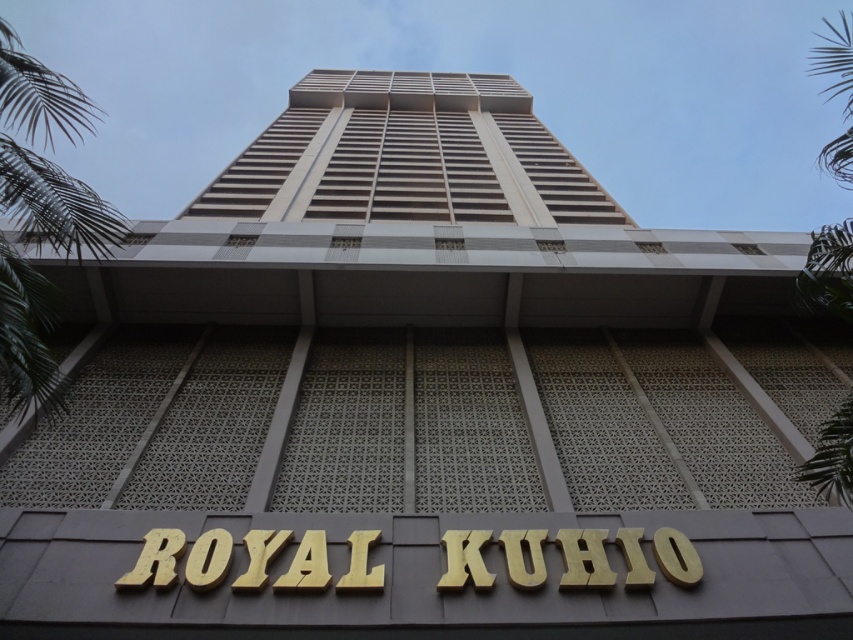
Question: Which point is closer to the camera?

Choices:
 (A) green leafy palm tree at left
 (B) beige concrete building at center
 (C) green leafy palm tree at right

Answer: (A)

Question: Where is beige concrete building at center located in relation to green leafy palm tree at left in the image?

Choices:
 (A) above
 (B) below

Answer: (A)

Question: Can you confirm if beige concrete building at center is positioned to the left of green leafy palm tree at left?

Choices:
 (A) no
 (B) yes

Answer: (A)

Question: Is green leafy palm tree at left positioned in front of green leafy palm tree at right?

Choices:
 (A) no
 (B) yes

Answer: (B)

Question: Which point appears farthest from the camera in this image?

Choices:
 (A) (837, 300)
 (B) (299, 204)

Answer: (B)

Question: Which point is farther from the camera taking this photo?

Choices:
 (A) click(840, 148)
 (B) click(3, 355)
 (C) click(254, 189)

Answer: (C)